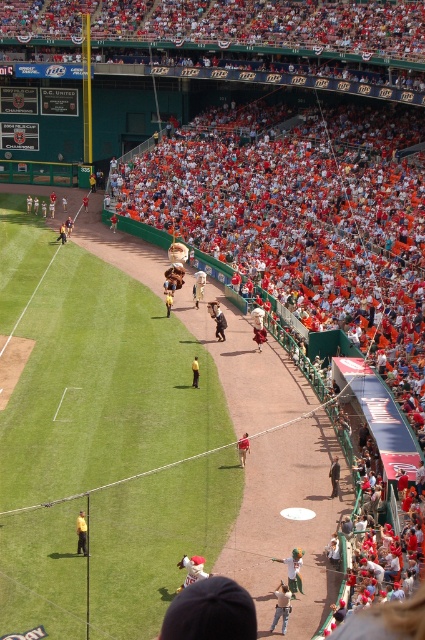
Question: Can you confirm if white cotton shirt at lower center is positioned to the right of brown leather jacket at center?

Choices:
 (A) yes
 (B) no

Answer: (A)

Question: Is white cotton shirt at lower center thinner than white fabric at center?

Choices:
 (A) no
 (B) yes

Answer: (B)

Question: Is brown leather jacket at center above red fabric person at center?

Choices:
 (A) no
 (B) yes

Answer: (B)

Question: Based on their relative distances, which object is farther from the red fabric person at center?

Choices:
 (A) white fabric at center
 (B) tan leather jacket at lower center
 (C) yellow fabric person at lower left
 (D) dark blue suit at center

Answer: (B)

Question: Which point appears farthest from the camera in this image?

Choices:
 (A) (223, 330)
 (B) (243, 440)

Answer: (A)

Question: Which object appears farthest from the camera in this image?

Choices:
 (A) white cotton shirt at lower center
 (B) brown leather jacket at center

Answer: (B)